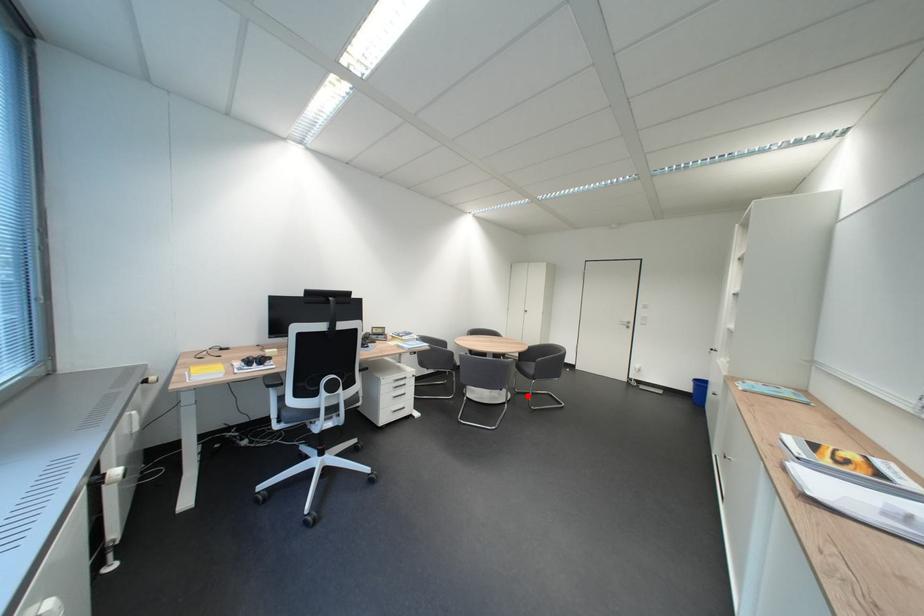
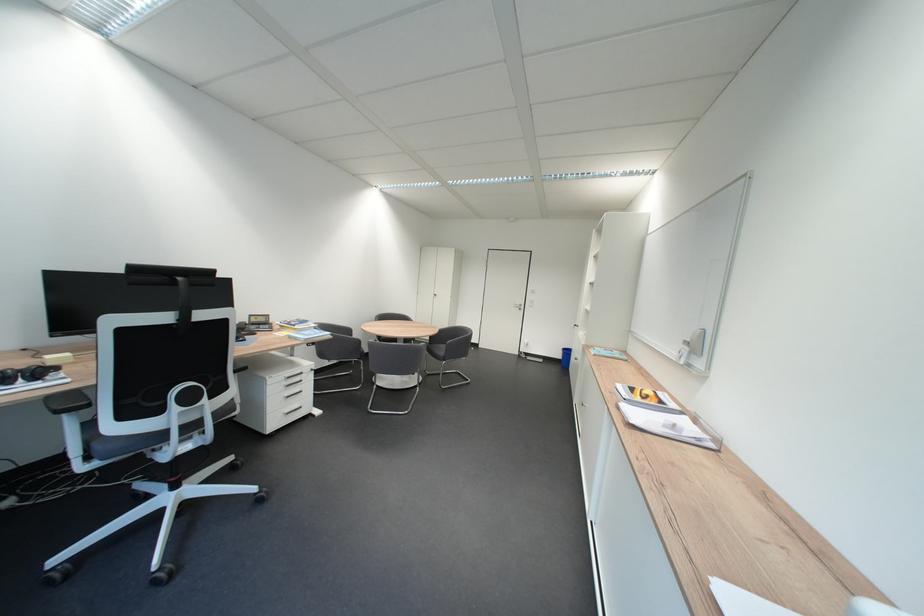
Question: I am providing you with two images of the same scene from different viewpoints. A red point is shown in image1. For the corresponding object point in image2, is it positioned nearer or farther from the camera?

Choices:
 (A) Nearer
 (B) Farther

Answer: (A)